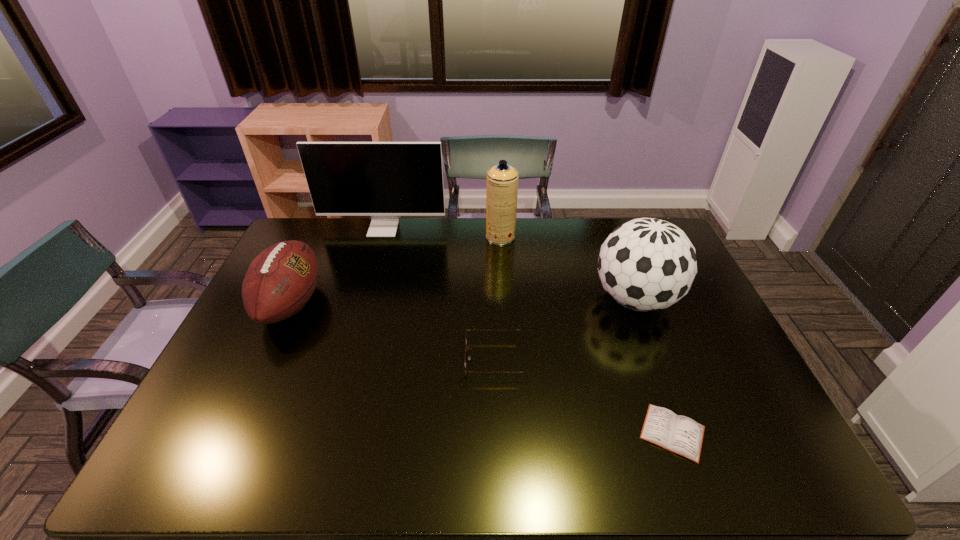
This screenshot has width=960, height=540. Find the location of `vacant space that is in between the soccer ball and the aerosol can`. vacant space that is in between the soccer ball and the aerosol can is located at coordinates (567, 268).

Image resolution: width=960 pixels, height=540 pixels. Identify the location of vacant area that lies between the nearest object and the monitor. (528, 330).

Where is `free space between the fourth tallest object and the diary`? free space between the fourth tallest object and the diary is located at coordinates click(x=482, y=368).

Identify the location of unoccupied area between the aerosol can and the diary. This screenshot has height=540, width=960. (587, 334).

Identify the location of object that is the closest to the football (American). The image size is (960, 540). (384, 180).

Identify which object is the third closest to the second shortest object. Please provide its 2D coordinates. Your answer should be formatted as a tuple, i.e. [(x, y)], where the tuple contains the x and y coordinates of a point satisfying the conditions above.

[(502, 180)]

The image size is (960, 540). Find the location of `vacant position in the image that satisfies the following two spatial constraints: 1. on the back side of the aerosol can; 2. on the left side of the fourth tallest object`. vacant position in the image that satisfies the following two spatial constraints: 1. on the back side of the aerosol can; 2. on the left side of the fourth tallest object is located at coordinates (322, 237).